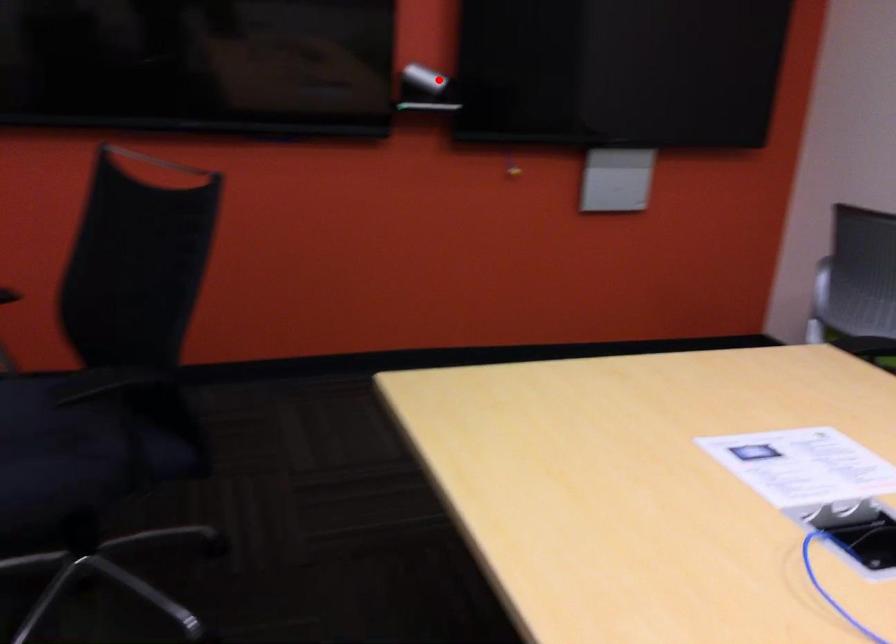
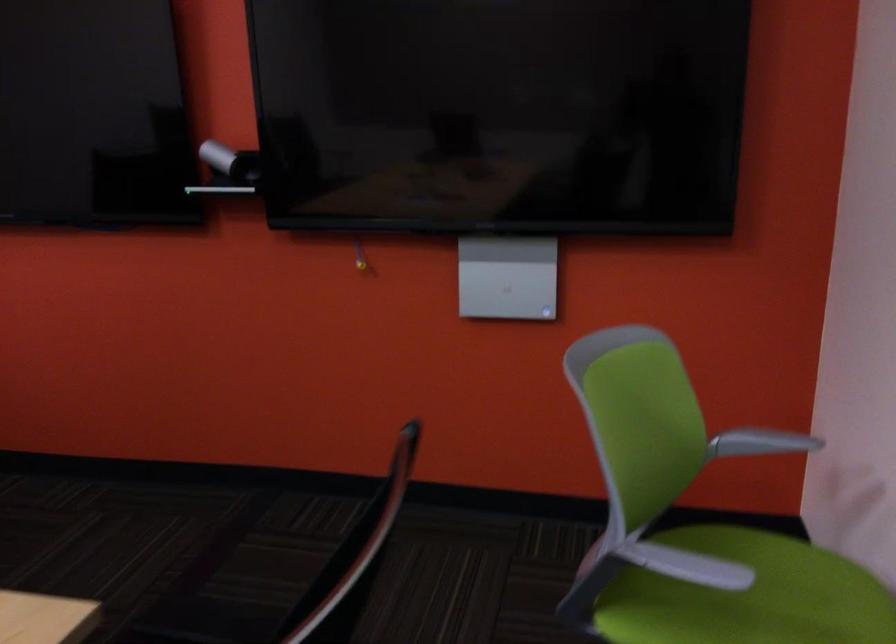
Question: I am providing you with two images of the same scene from different viewpoints. Given a red point in image1, look at the same physical point in image2. Is it:

Choices:
 (A) Closer to the viewpoint
 (B) Farther from the viewpoint

Answer: (A)